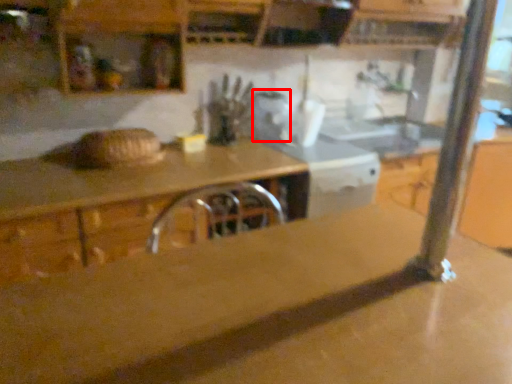
Question: From the image, what is the correct spatial relationship of appliance (annotated by the red box) in relation to countertop?

Choices:
 (A) left
 (B) right

Answer: (B)